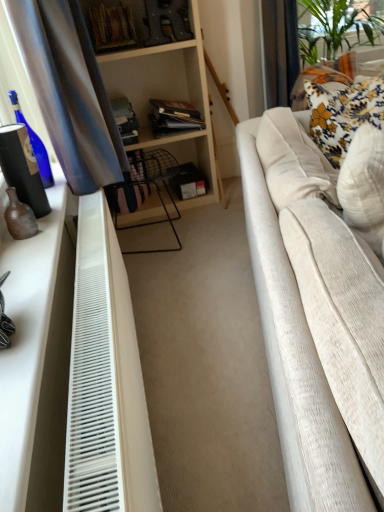
Question: From the image's perspective, relative to white matte dresser at left, is white textured pillow at right, acting as the second pillow starting from the back, above or below?

Choices:
 (A) above
 (B) below

Answer: (A)

Question: From a real-world perspective, is white textured pillow at right, acting as the second pillow starting from the back, physically located above or below white matte dresser at left?

Choices:
 (A) below
 (B) above

Answer: (A)

Question: Which is nearer to the white plastic radiator at lower left?

Choices:
 (A) white matte dresser at left
 (B) satin blue curtain at left
 (C) white textured pillow at right, acting as the second pillow starting from the back
 (D) beige fabric couch at right
 (E) floral fabric pillow at upper right, marked as the first pillow in a back-to-front arrangement

Answer: (A)

Question: Estimate the real-world distances between objects in this image. Which object is closer to the satin blue curtain at left?

Choices:
 (A) white matte dresser at left
 (B) beige fabric couch at right
 (C) white plastic radiator at lower left
 (D) floral fabric pillow at upper right, marked as the 2th pillow in a front-to-back arrangement
 (E) white textured pillow at right, the 1th pillow viewed from the front

Answer: (C)